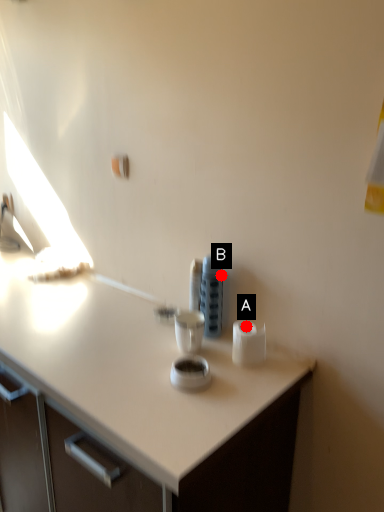
Question: Two points are circled on the image, labeled by A and B beside each circle. Among these points, which one is farthest from the camera?

Choices:
 (A) A is further
 (B) B is further

Answer: (B)